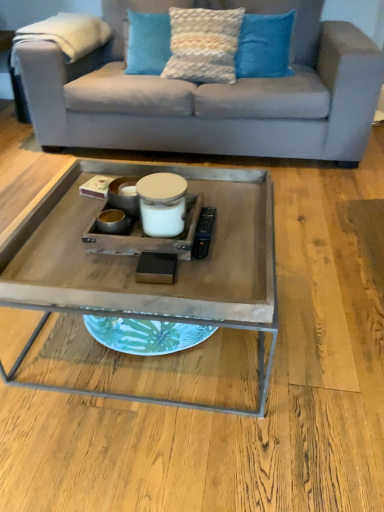
Question: Does blue textured pillow at upper center, marked as the first pillow in a right-to-left arrangement, have a lesser width compared to textured cream pillow at upper center, which is the second pillow from right to left?

Choices:
 (A) yes
 (B) no

Answer: (A)

Question: From the image's perspective, is blue textured pillow at upper center, which ranks as the third pillow in left-to-right order, on textured cream pillow at upper center, acting as the second pillow starting from the left?

Choices:
 (A) no
 (B) yes

Answer: (B)

Question: Considering the relative positions of blue textured pillow at upper center, marked as the first pillow in a right-to-left arrangement, and textured cream pillow at upper center, acting as the second pillow starting from the left, in the image provided, is blue textured pillow at upper center, marked as the first pillow in a right-to-left arrangement, to the right of textured cream pillow at upper center, acting as the second pillow starting from the left, from the viewer's perspective?

Choices:
 (A) yes
 (B) no

Answer: (A)

Question: Is blue textured pillow at upper center, which ranks as the third pillow in left-to-right order, facing away from textured cream pillow at upper center, acting as the second pillow starting from the left?

Choices:
 (A) yes
 (B) no

Answer: (B)

Question: Does blue textured pillow at upper center, marked as the first pillow in a right-to-left arrangement, lie behind textured cream pillow at upper center, acting as the second pillow starting from the left?

Choices:
 (A) no
 (B) yes

Answer: (B)

Question: Does blue textured pillow at upper center, which ranks as the third pillow in left-to-right order, have a smaller size compared to textured cream pillow at upper center, acting as the second pillow starting from the left?

Choices:
 (A) no
 (B) yes

Answer: (B)

Question: Can you confirm if blue textured pillow at upper center, which ranks as the third pillow in left-to-right order, is taller than light gray fabric couch at upper center?

Choices:
 (A) yes
 (B) no

Answer: (B)

Question: Is blue textured pillow at upper center, which ranks as the third pillow in left-to-right order, thinner than light gray fabric couch at upper center?

Choices:
 (A) yes
 (B) no

Answer: (A)

Question: From the image's perspective, is blue textured pillow at upper center, marked as the first pillow in a right-to-left arrangement, below light gray fabric couch at upper center?

Choices:
 (A) yes
 (B) no

Answer: (B)

Question: Does blue textured pillow at upper center, which ranks as the third pillow in left-to-right order, lie in front of light gray fabric couch at upper center?

Choices:
 (A) no
 (B) yes

Answer: (A)

Question: From a real-world perspective, is blue textured pillow at upper center, which ranks as the third pillow in left-to-right order, beneath light gray fabric couch at upper center?

Choices:
 (A) no
 (B) yes

Answer: (A)

Question: Is blue textured pillow at upper center, which ranks as the third pillow in left-to-right order, not within light gray fabric couch at upper center?

Choices:
 (A) no
 (B) yes

Answer: (A)

Question: Is textured cream pillow at upper center, acting as the second pillow starting from the left, surrounding textured blue pillow at upper center, the third pillow from the right?

Choices:
 (A) no
 (B) yes

Answer: (A)